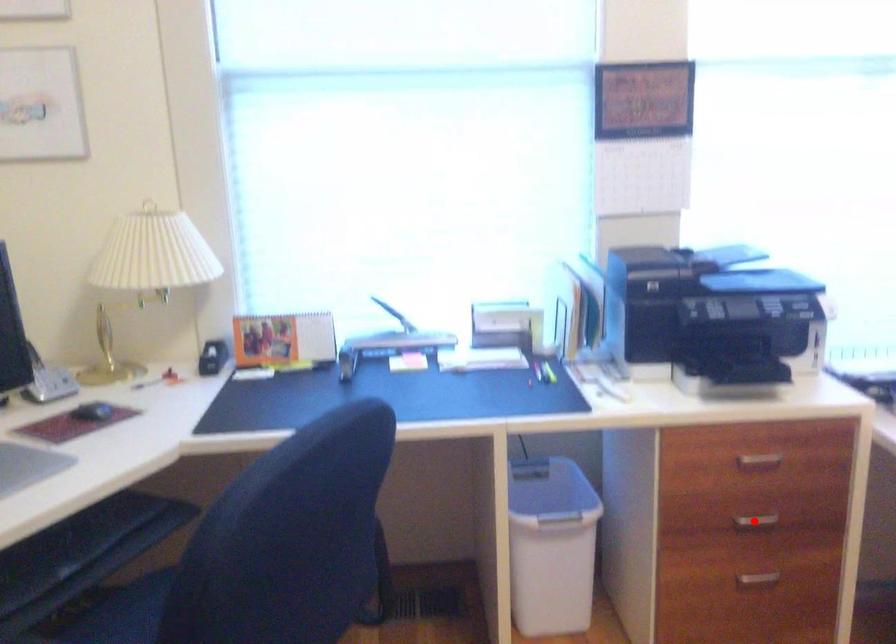
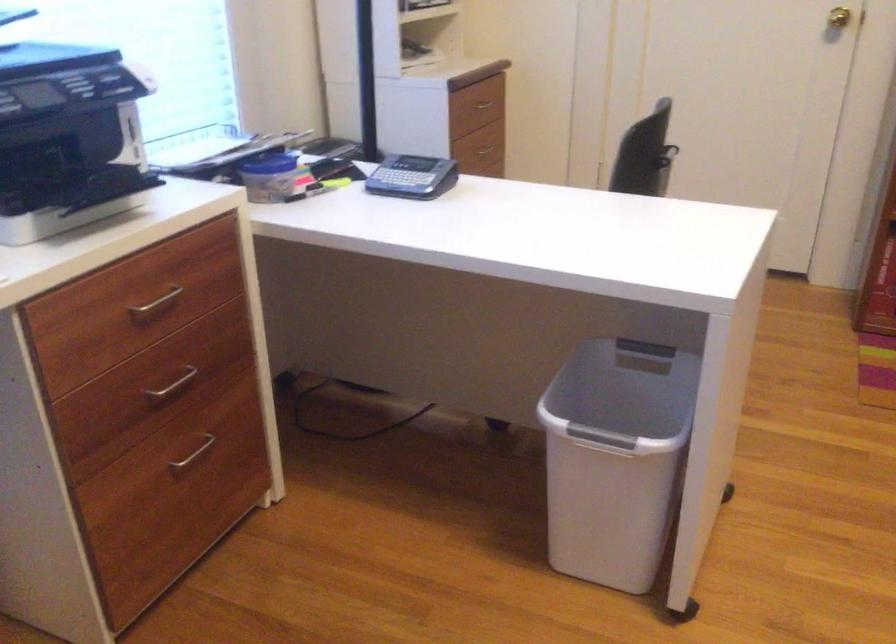
The point at the highlighted location is marked in the first image. Where is the corresponding point in the second image?

(173, 384)